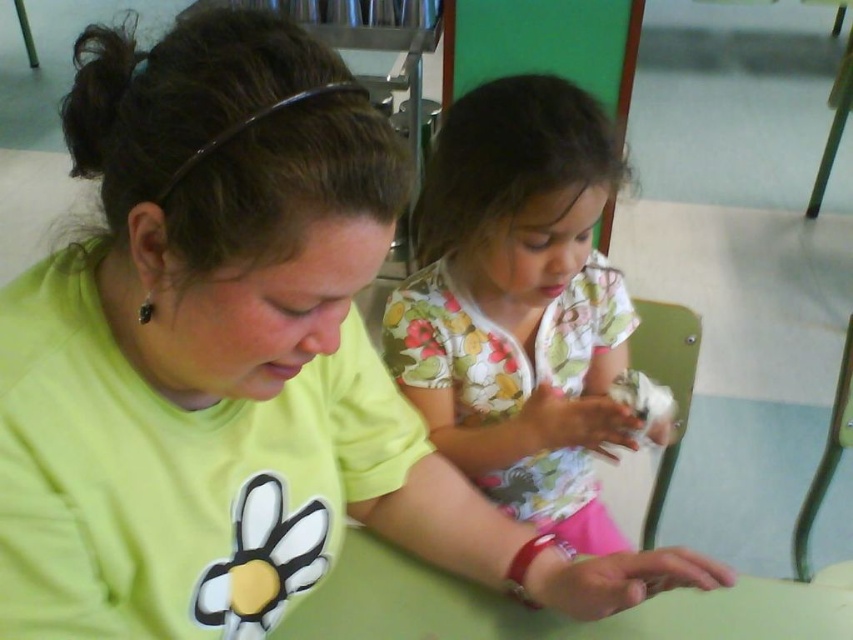
Question: Among these points, which one is farthest from the camera?

Choices:
 (A) (392, 554)
 (B) (508, 433)

Answer: (B)

Question: Which point is closer to the camera taking this photo?

Choices:
 (A) (692, 592)
 (B) (566, 179)

Answer: (B)

Question: Can you confirm if floral cotton shirt at center is positioned to the left of green matte table at center?

Choices:
 (A) no
 (B) yes

Answer: (B)

Question: Can you confirm if floral cotton shirt at center is wider than green matte table at center?

Choices:
 (A) yes
 (B) no

Answer: (B)

Question: Is floral cotton shirt at center wider than green matte table at center?

Choices:
 (A) yes
 (B) no

Answer: (B)

Question: Which of the following is the closest to the observer?

Choices:
 (A) (664, 429)
 (B) (550, 636)

Answer: (B)